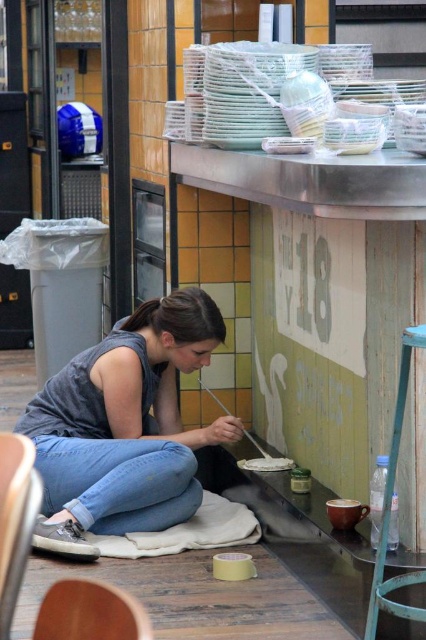
You are standing at the counter in the food stall. There are two points marked on the counter. One is at point coordinates (42, 397) and the other is at (264, 470). If you want to reach the point that is behind the other, which coordinates should you go to?

You should go to point coordinates (42, 397) because it is behind point coordinates 0.736, 0.22.

You are a customer at the food stall and want to grab the gray cotton shirt at center and the white matte paint at lower center. Which item is easier to reach without moving your position?

The gray cotton shirt at center is closer to you, so it is easier to reach without moving your position.

You are a customer at this food stall and want to place an order. You notice the gray cotton shirt at center and the white matte paint at lower center. Which object is closer to your left side?

The gray cotton shirt at center is to the left of white matte paint at lower center, so it is closer to your left side.